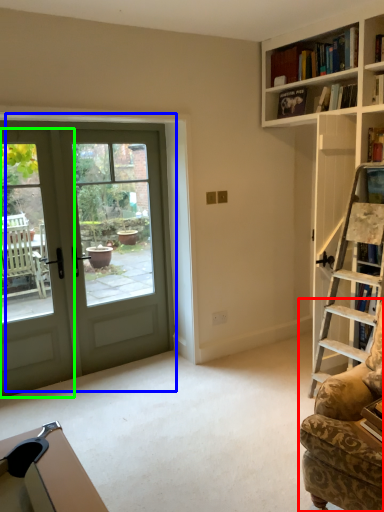
Question: Considering the real-world distances, which object is closest to rocking chair (highlighted by a red box)? door (highlighted by a blue box) or screen door (highlighted by a green box).

Choices:
 (A) door
 (B) screen door

Answer: (A)